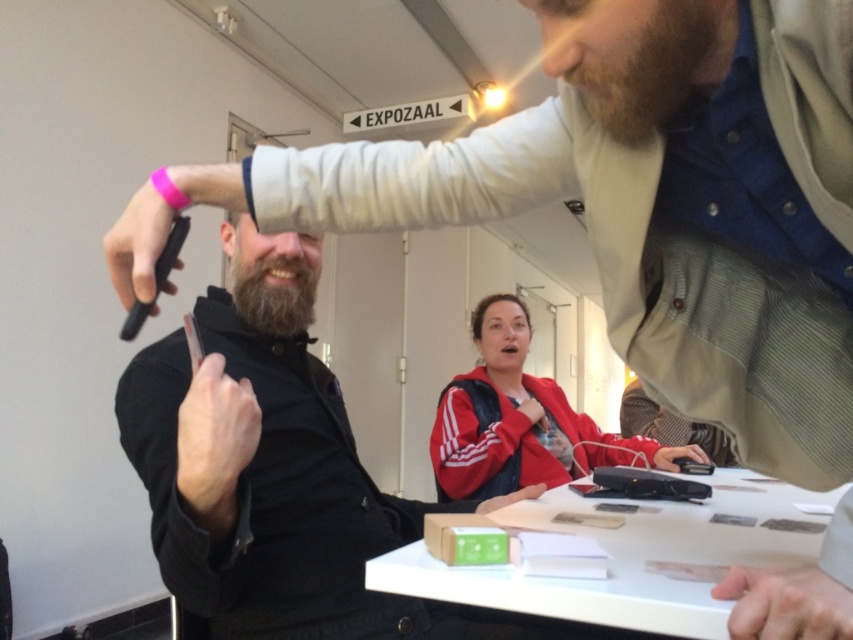
Question: Can you confirm if smooth skin hand at lower right is positioned to the right of dark brown thick beard at center?

Choices:
 (A) yes
 (B) no

Answer: (A)

Question: Is black matte jacket at center below smooth black hand at center?

Choices:
 (A) yes
 (B) no

Answer: (A)

Question: Which of the following is the closest to the observer?

Choices:
 (A) dark brown textured beard at upper right
 (B) smooth skin hand at lower right
 (C) red adidas jacket at center
 (D) matte black pen at upper left

Answer: (B)

Question: Does black matte jacket at center appear over dark brown thick beard at center?

Choices:
 (A) no
 (B) yes

Answer: (A)

Question: Which point appears farthest from the camera in this image?

Choices:
 (A) (257, 632)
 (B) (223, 502)
 (C) (440, 499)
 (D) (610, 77)

Answer: (C)

Question: Which point is closer to the camera?

Choices:
 (A) black matte jacket at center
 (B) dark brown textured beard at upper right
 (C) smooth black hand at center
 (D) red adidas jacket at center

Answer: (B)